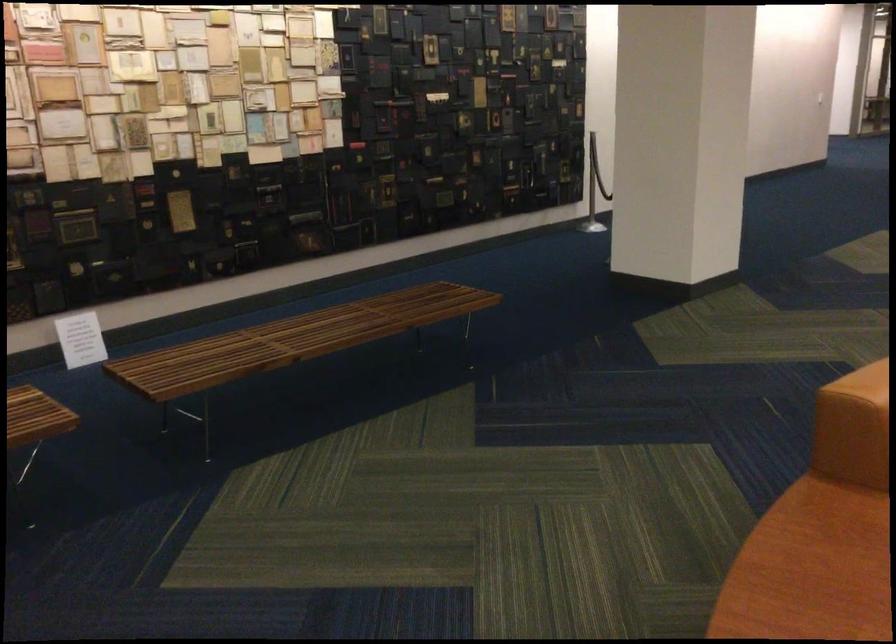
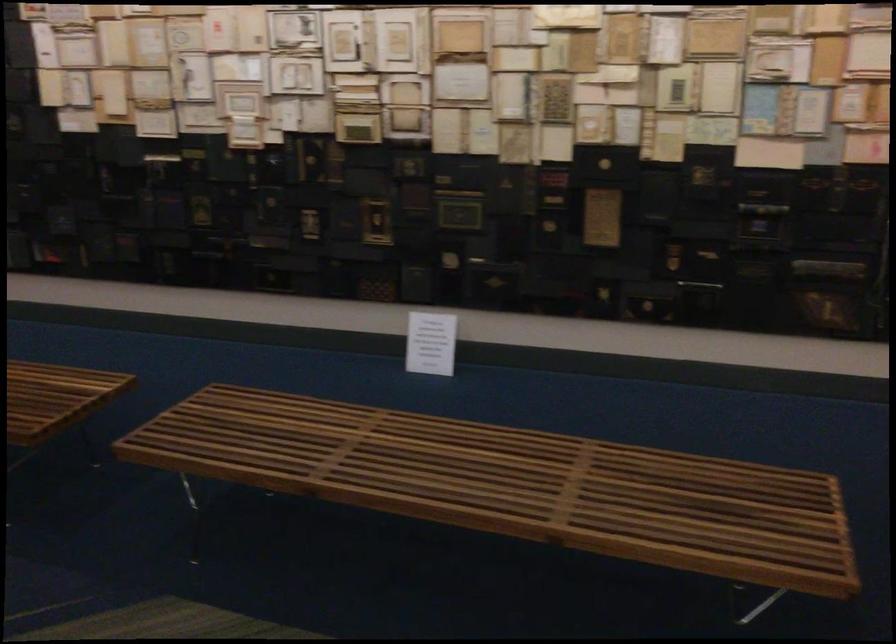
Locate, in the second image, the point that corresponds to (345,319) in the first image.

(501, 475)